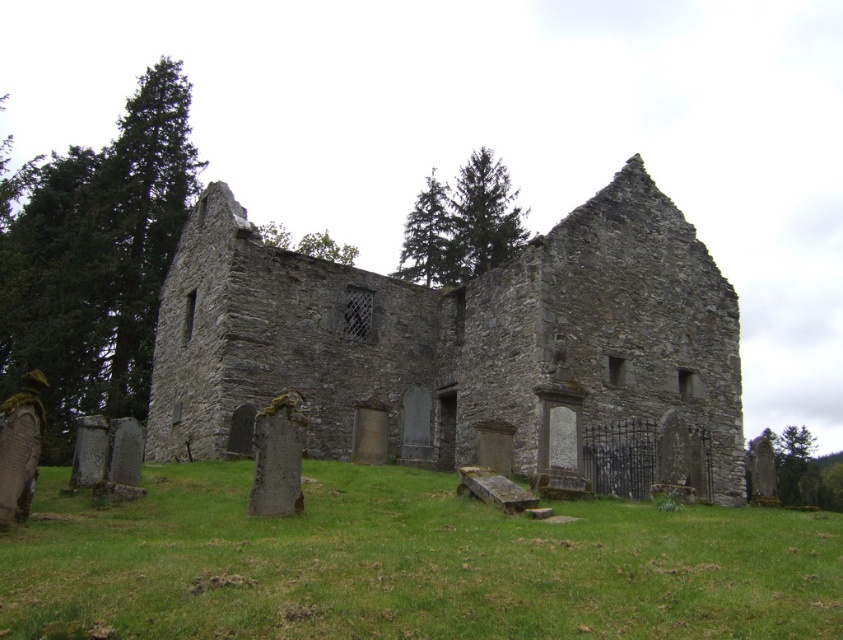
You are standing in front of the old stone ruin and want to take a photo. There are two points marked in the scene, point 1 at coordinates point (197, 488) and point 2 at coordinates point (497, 304). Which point is closer to you?

Point (197, 488) is closer to the viewer than point (497, 304), so point 1 is closer to you.